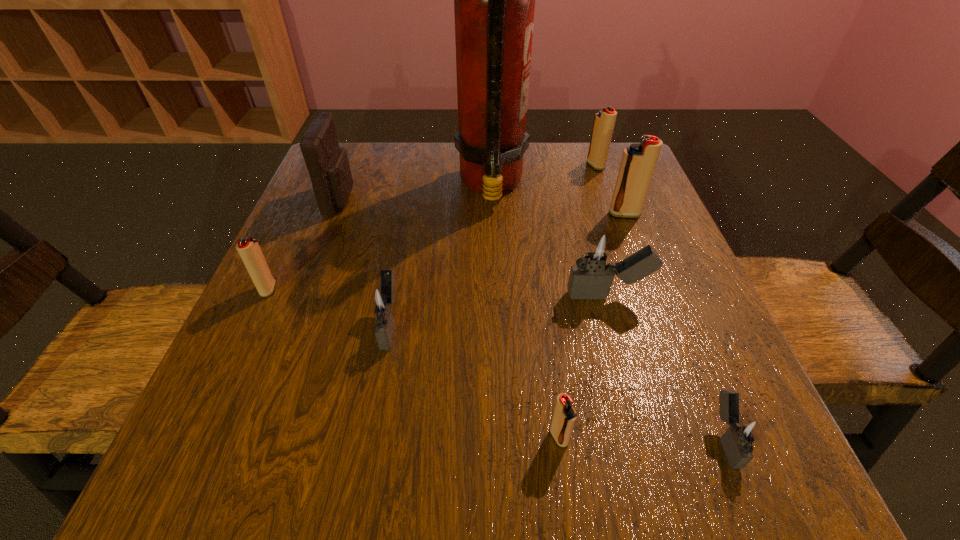
What are the coordinates of `vacant space located 0.220m with an open flap on the eighth object from right to left` in the screenshot? It's located at (452, 199).

I want to click on free space located on the front of the second biggest red igniter, so click(620, 237).

Image resolution: width=960 pixels, height=540 pixels. In order to click on vacant space located 0.180m on the back of the biggest gray igniter in this screenshot , I will do `click(587, 220)`.

At what (x,y) coordinates should I click in order to perform the action: click on free space located 0.200m on the front of the seventh object from right to left. Please return your answer as a coordinate pair (x, y). The height and width of the screenshot is (540, 960). Looking at the image, I should click on (361, 483).

Identify the location of vacant space positioned 0.100m on the back of the third farthest red igniter. Image resolution: width=960 pixels, height=540 pixels. (289, 245).

This screenshot has height=540, width=960. What are the coordinates of `vacant space located on the back of the second red igniter from left to right` in the screenshot? It's located at (545, 334).

Image resolution: width=960 pixels, height=540 pixels. I want to click on free location located on the back of the rightmost gray igniter, so click(640, 232).

Where is `fire extinguisher located in the far edge section of the desktop`? This screenshot has height=540, width=960. fire extinguisher located in the far edge section of the desktop is located at coordinates (494, 0).

The width and height of the screenshot is (960, 540). What are the coordinates of `pouch located at the far edge` in the screenshot? It's located at (327, 163).

This screenshot has width=960, height=540. Find the location of `igniter that is at the far edge`. igniter that is at the far edge is located at coordinates (604, 121).